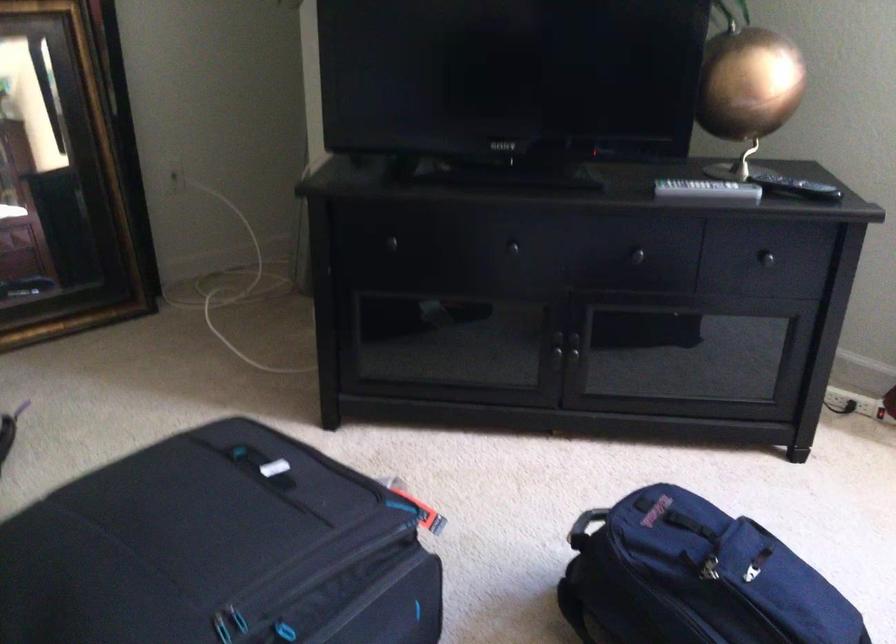
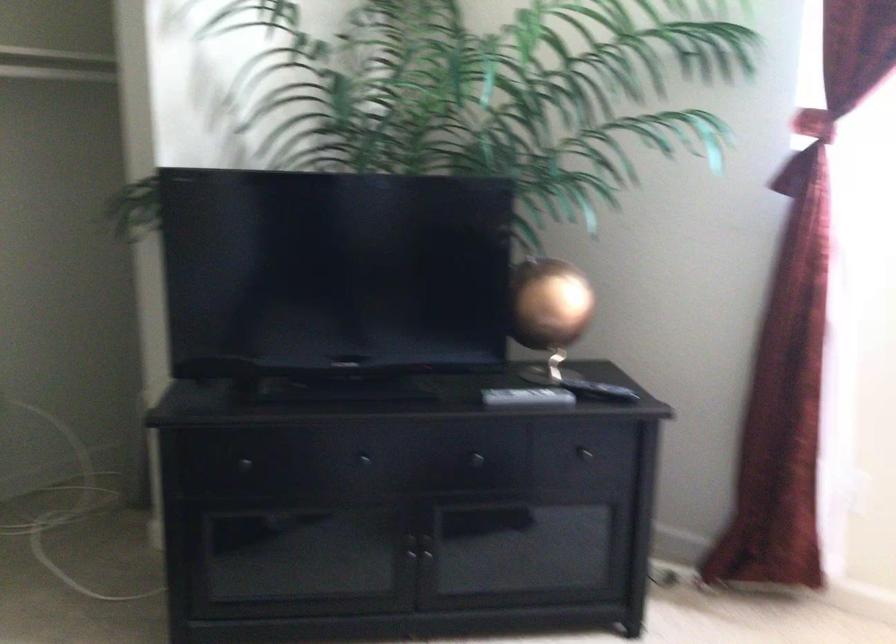
Where in the second image is the point corresponding to point (384, 245) from the first image?

(239, 464)